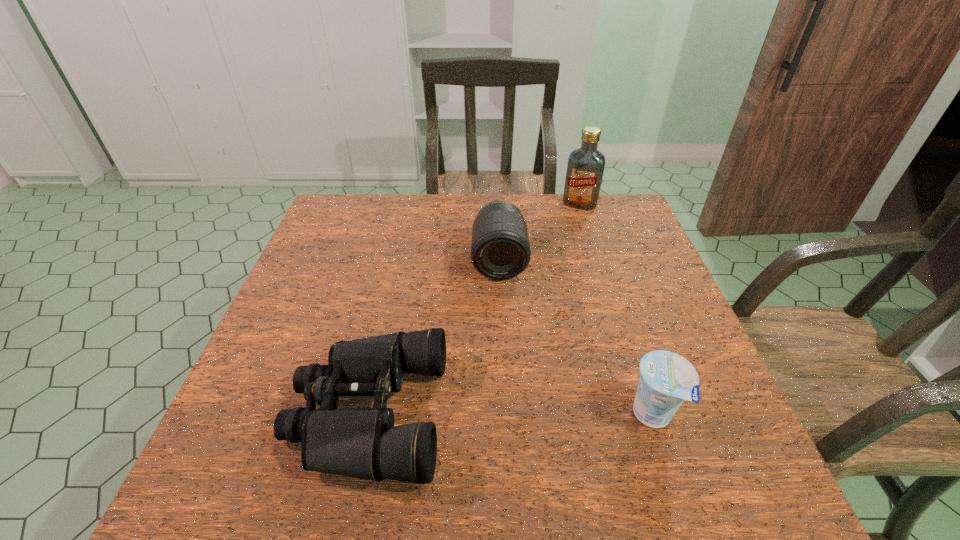
The width and height of the screenshot is (960, 540). Identify the location of the shortest object. (363, 443).

Image resolution: width=960 pixels, height=540 pixels. I want to click on the leftmost object, so click(x=363, y=443).

Where is `yogurt`? This screenshot has width=960, height=540. yogurt is located at coordinates (667, 379).

You are a GUI agent. You are given a task and a screenshot of the screen. Output one action in this format:
    pyautogui.click(x=<x>, y=<y>)
    Task: Click on the second object from left to right
    
    Given the screenshot: What is the action you would take?
    pyautogui.click(x=500, y=249)

You are a GUI agent. You are given a task and a screenshot of the screen. Output one action in this format:
    pyautogui.click(x=<x>, y=<y>)
    Task: Click on the second tallest object
    
    Given the screenshot: What is the action you would take?
    pyautogui.click(x=500, y=249)

This screenshot has width=960, height=540. I want to click on vodka, so click(x=585, y=168).

The image size is (960, 540). Identify the location of the farthest object. (585, 168).

The image size is (960, 540). Identify the location of vacant position located 0.080m through the eyepieces of the leftmost object. (251, 413).

What are the coordinates of `vacant space located on the back of the third tallest object` in the screenshot? It's located at (634, 359).

This screenshot has height=540, width=960. Find the location of `free space located 0.150m on the surface of the third object from right to left`. free space located 0.150m on the surface of the third object from right to left is located at coordinates (501, 326).